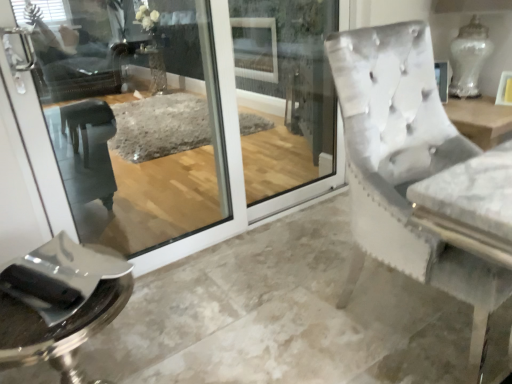
The height and width of the screenshot is (384, 512). What are the coordinates of `empty space that is ontop of polished chrome tray at lower left (from a real-world perspective)` in the screenshot? It's located at (70, 286).